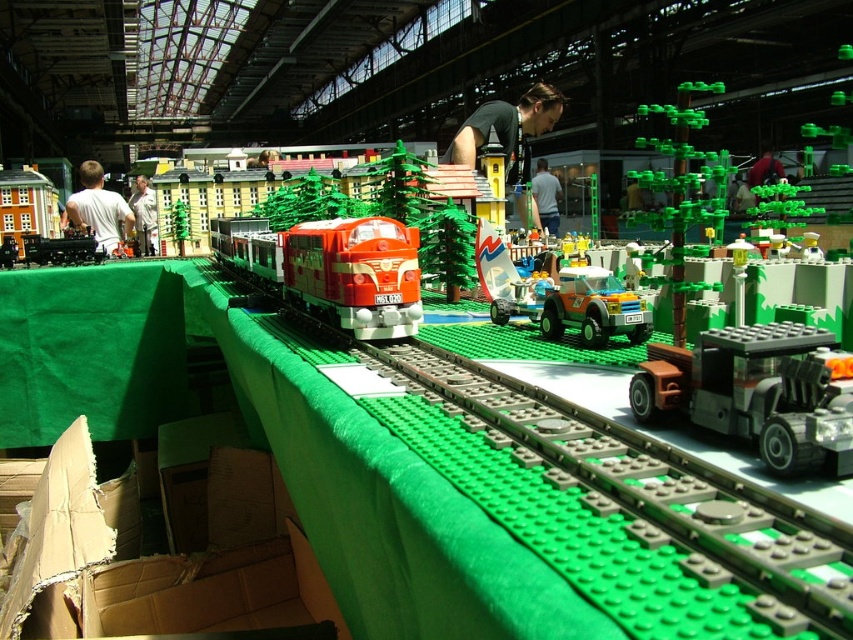
You are a toy designer observing the Lego model train set. You need to determine if the dark gray metallic truck at center right can fit under the matte plastic train at center without any modifications. Can it pass underneath?

The dark gray metallic truck at center right has a lesser height compared to the matte plastic train at center, so it can pass underneath the train without any issues.

You are a visitor at the Lego exhibition and want to take a photo of both the dark gray metallic truck at center right and the translucent orange plastic car at center. Which object should you focus on first to ensure both are in the frame?

You should focus on the dark gray metallic truck at center right first because it is closer to the viewer than the translucent orange plastic car at center, ensuring both are in the frame when properly positioned.